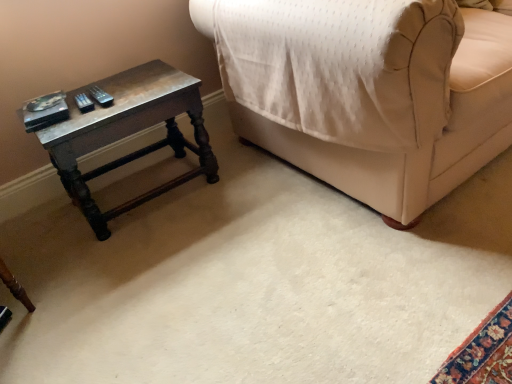
Question: Is wooden table at left to the left or to the right of beige fabric couch at upper right in the image?

Choices:
 (A) right
 (B) left

Answer: (B)

Question: Looking at the image, does wooden table at left seem bigger or smaller compared to beige fabric couch at upper right?

Choices:
 (A) small
 (B) big

Answer: (A)

Question: From a real-world perspective, is wooden table at left positioned above or below beige fabric couch at upper right?

Choices:
 (A) above
 (B) below

Answer: (B)

Question: Do you think beige fabric couch at upper right is within wooden table at left, or outside of it?

Choices:
 (A) inside
 (B) outside

Answer: (B)

Question: From their relative heights in the image, would you say beige fabric couch at upper right is taller or shorter than wooden table at left?

Choices:
 (A) tall
 (B) short

Answer: (A)

Question: Is point (371, 178) positioned closer to the camera than point (108, 228)?

Choices:
 (A) closer
 (B) farther

Answer: (A)

Question: From the image's perspective, relative to wooden table at left, is beige fabric couch at upper right above or below?

Choices:
 (A) below
 (B) above

Answer: (B)